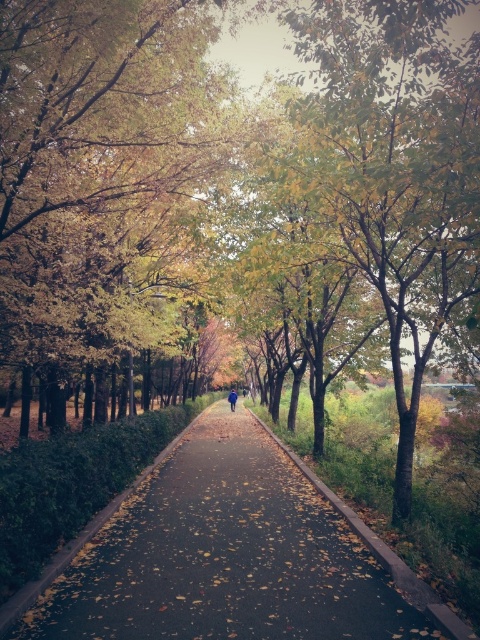
Question: Does golden leaves at center appear over blue fabric jacket at center?

Choices:
 (A) no
 (B) yes

Answer: (B)

Question: Is dark asphalt path at center bigger than blue fabric jacket at center?

Choices:
 (A) yes
 (B) no

Answer: (A)

Question: Which point is closer to the camera?

Choices:
 (A) blue fabric jacket at center
 (B) golden leaves at center
 (C) dark asphalt path at center

Answer: (C)

Question: Which point is closer to the camera?

Choices:
 (A) pos(232,388)
 (B) pos(345,637)

Answer: (B)

Question: Does golden leaves at center appear on the right side of blue fabric jacket at center?

Choices:
 (A) yes
 (B) no

Answer: (B)

Question: Which point is farther from the camera taking this photo?

Choices:
 (A) (228, 400)
 (B) (23, 113)
 (C) (315, 604)

Answer: (A)